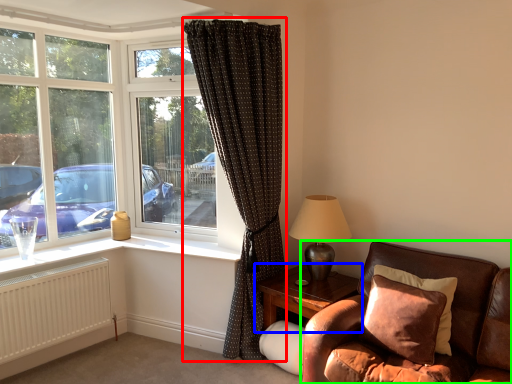
Question: Considering the real-world distances, which object is farthest from curtain (highlighted by a red box)? table (highlighted by a blue box) or studio couch (highlighted by a green box)?

Choices:
 (A) table
 (B) studio couch

Answer: (B)